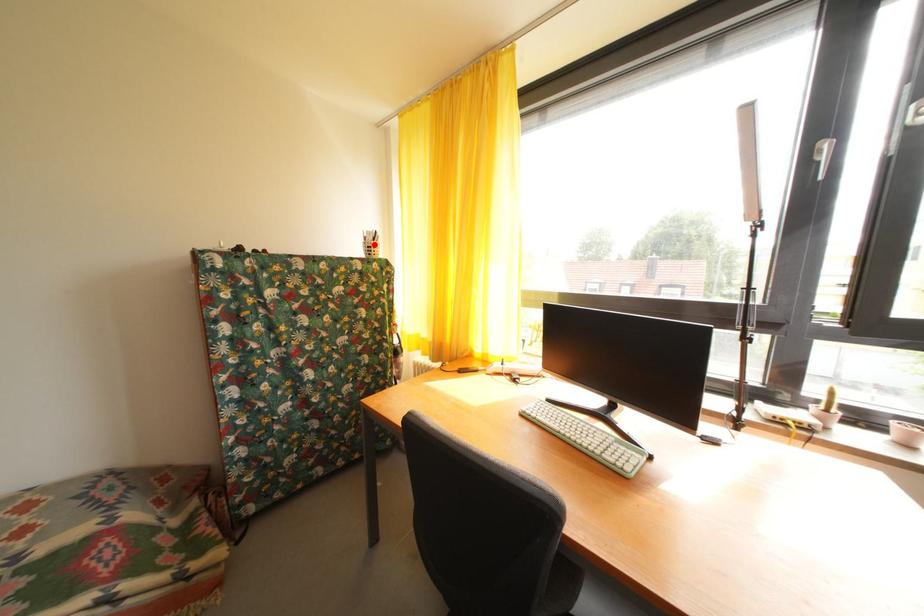
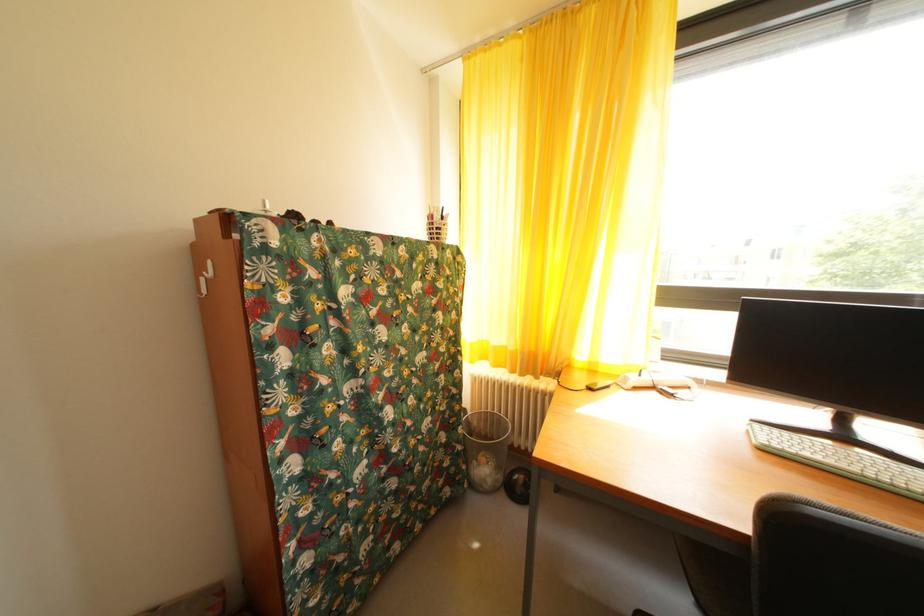
The point at the highlighted location is marked in the first image. Where is the corresponding point in the second image?

(440, 223)